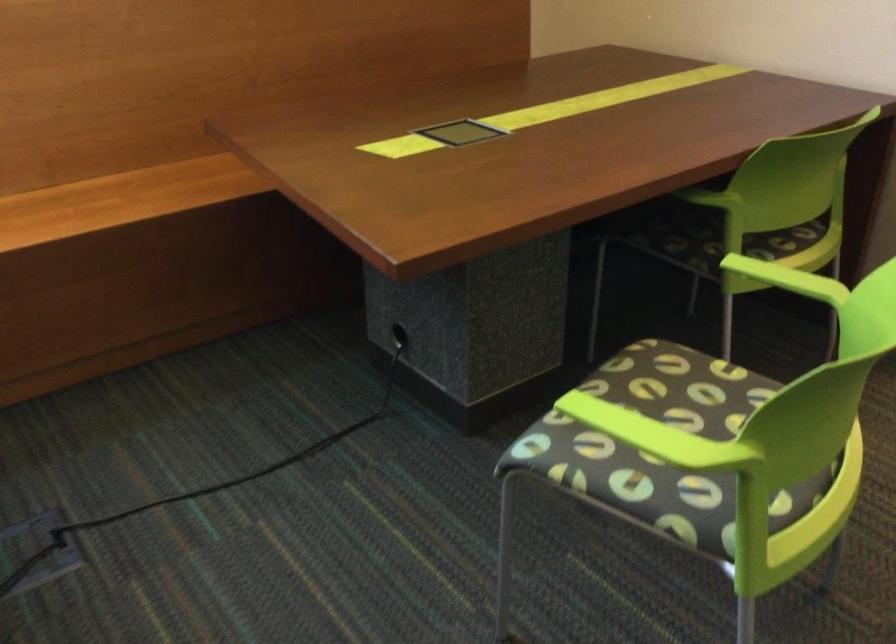
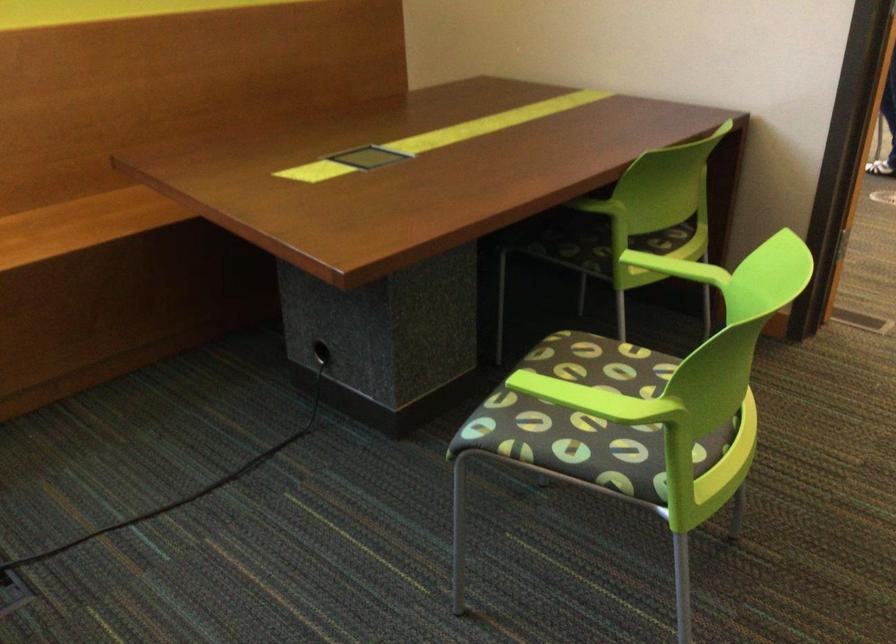
Find the pixel in the second image that matches [785,278] in the first image.

(676, 268)